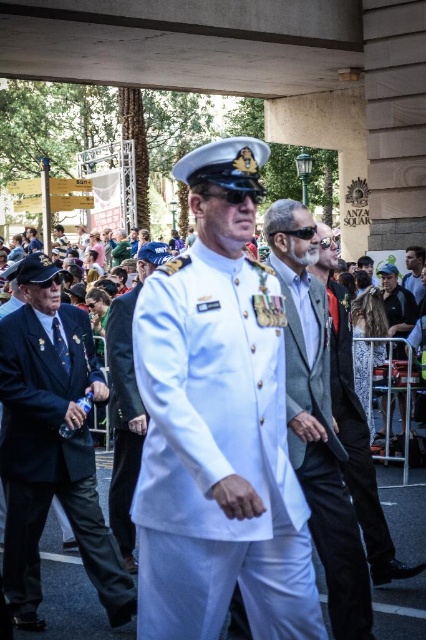
Question: Which object is closer to the camera taking this photo?

Choices:
 (A) white matte uniform at center
 (B) dark blue fabric suit at left
 (C) gray wool suit at center

Answer: (A)

Question: Which point appears farthest from the camera in this image?

Choices:
 (A) (129, 541)
 (B) (279, 460)
 (C) (414, 248)
 (D) (34, 580)

Answer: (C)

Question: Is white uniform at center thinner than smooth black jacket at center?

Choices:
 (A) no
 (B) yes

Answer: (A)

Question: Which point is closer to the camera taking this photo?

Choices:
 (A) 212,524
 (B) 126,420
 (C) 284,220

Answer: (A)

Question: Does white uniform at center lie behind black textured dress at right?

Choices:
 (A) yes
 (B) no

Answer: (B)

Question: Where is dark blue fabric suit at left located in relation to white uniform at center in the image?

Choices:
 (A) left
 (B) right

Answer: (A)